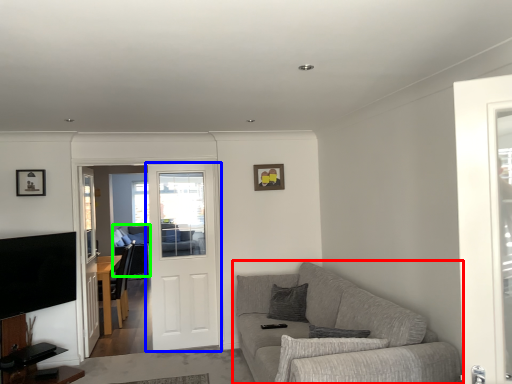
Question: Estimate the real-world distances between objects in this image. Which object is closer to studio couch (highlighted by a red box), door (highlighted by a blue box) or couch (highlighted by a green box)?

Choices:
 (A) door
 (B) couch

Answer: (A)